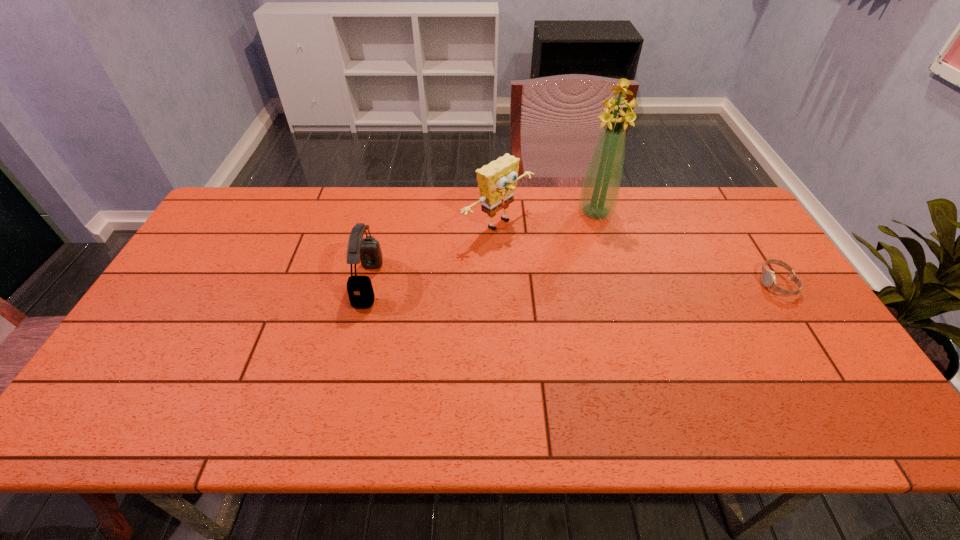
Image resolution: width=960 pixels, height=540 pixels. Find the location of `free space on the desktop that is between the headset and the rightmost object and is positioned on the front-facing side of the tallest object`. free space on the desktop that is between the headset and the rightmost object and is positioned on the front-facing side of the tallest object is located at coordinates (569, 283).

What are the coordinates of `vacant spot on the desktop that is between the second shortest object and the watch and is positioned on the face of the sponge` in the screenshot? It's located at (593, 283).